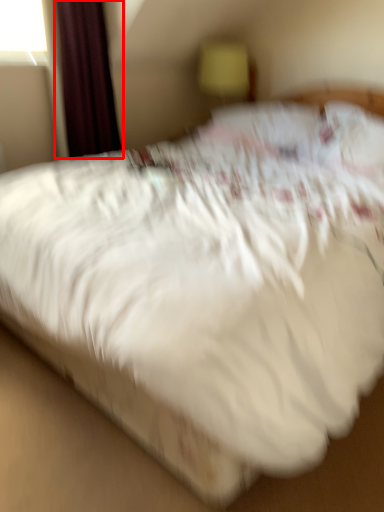
Question: From the image's perspective, where is curtain (annotated by the red box) located in relation to table lamp in the image?

Choices:
 (A) above
 (B) below

Answer: (B)